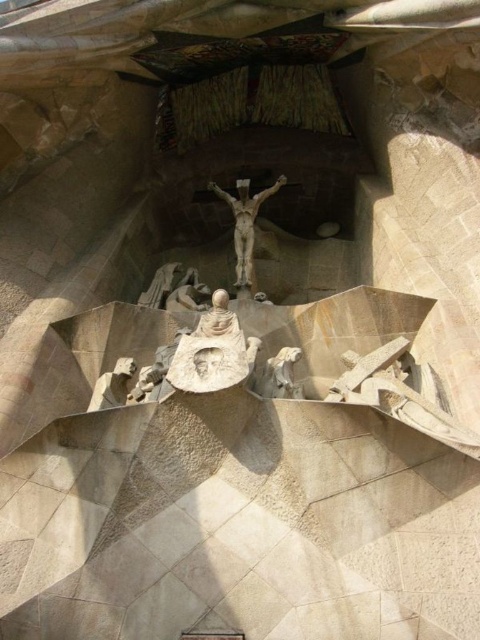
Question: Is polished bronze crucifix at center above white marble statue at center?

Choices:
 (A) no
 (B) yes

Answer: (B)

Question: Which of the following is the farthest from the observer?

Choices:
 (A) (243, 365)
 (B) (208, 326)
 (C) (280, 355)

Answer: (C)

Question: Is white stone figure at lower left bigger than white marble statue at center?

Choices:
 (A) no
 (B) yes

Answer: (B)

Question: Based on their relative distances, which object is farther from the white stone figure at lower left?

Choices:
 (A) smooth stone figure at lower left
 (B) light beige stone statue at center

Answer: (B)

Question: Where is light beige stone statue at center located in relation to smooth stone figure at lower left in the image?

Choices:
 (A) below
 (B) above

Answer: (B)

Question: Among these points, which one is nearest to the camera?

Choices:
 (A) (297, 388)
 (B) (238, 252)
 (C) (195, 273)
 (D) (215, 292)

Answer: (A)